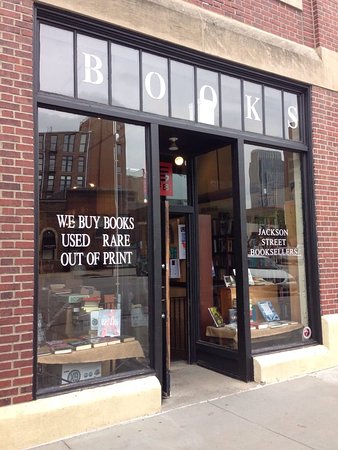
Where is `door`? This screenshot has width=338, height=450. door is located at coordinates (166, 272).